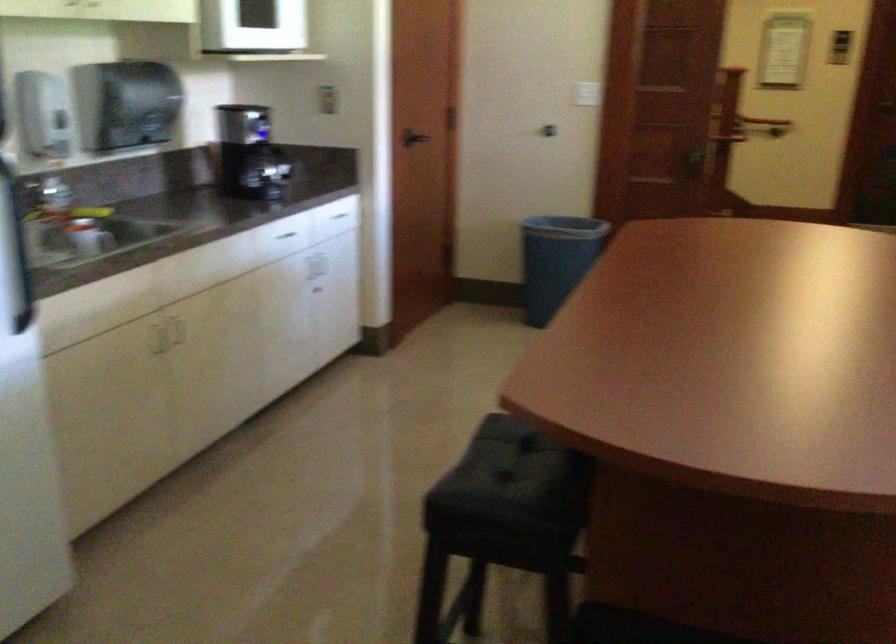
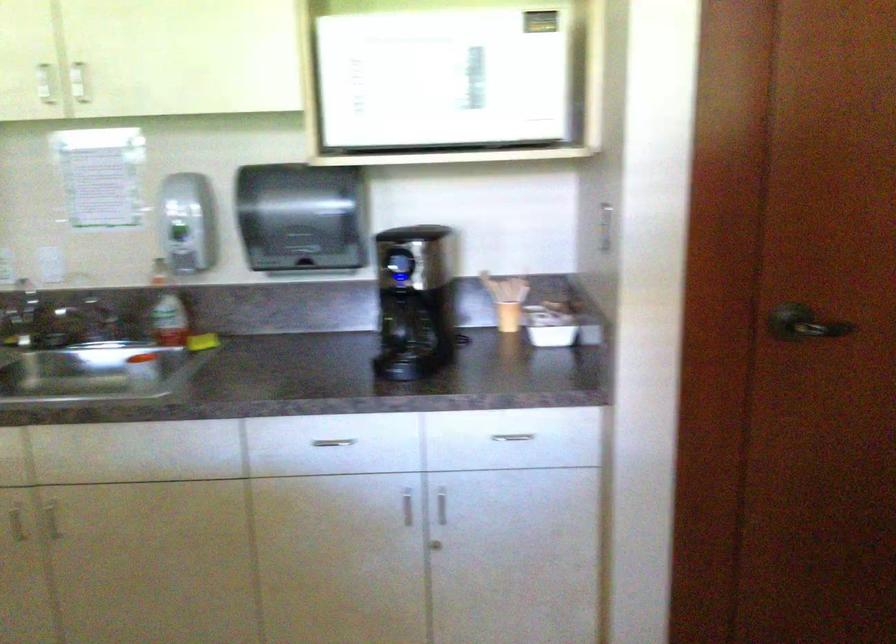
The point at (317, 265) is marked in the first image. Where is the corresponding point in the second image?

(442, 506)